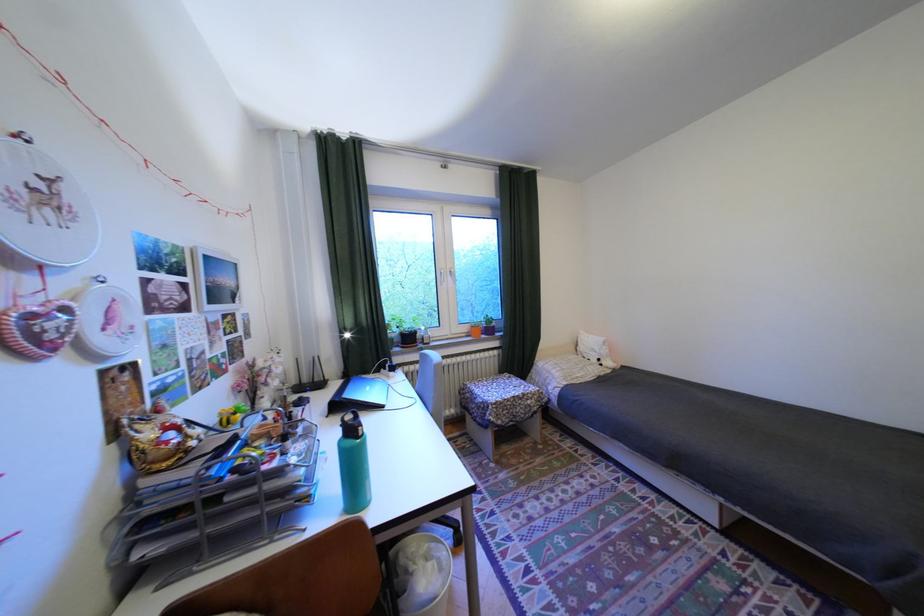
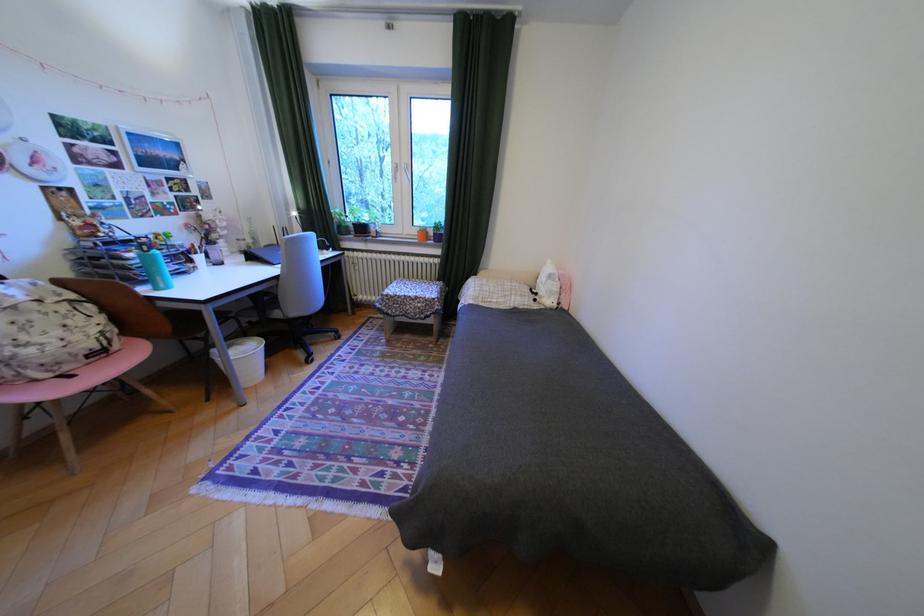
In the second image, find the point that corresponds to pixel 478 329 in the first image.

(427, 232)